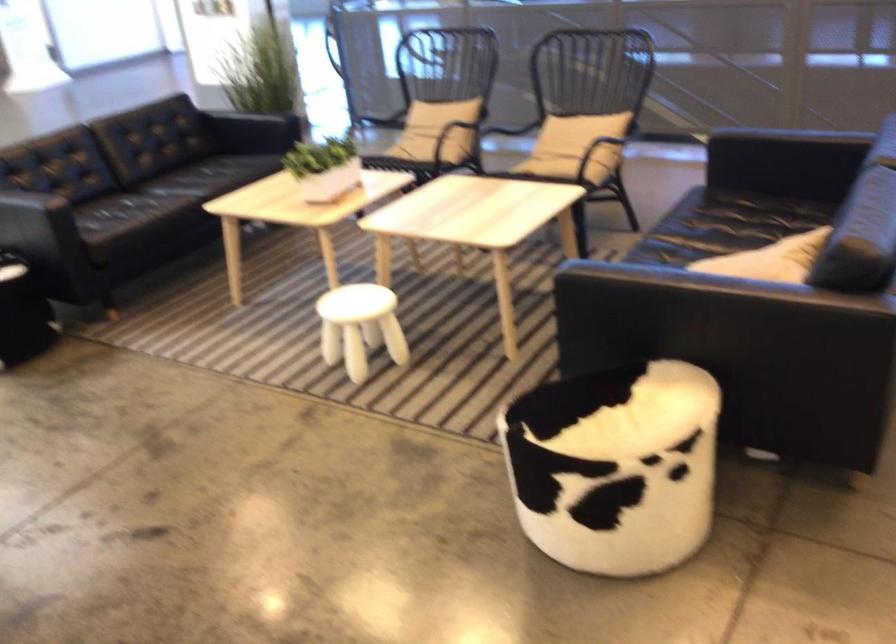
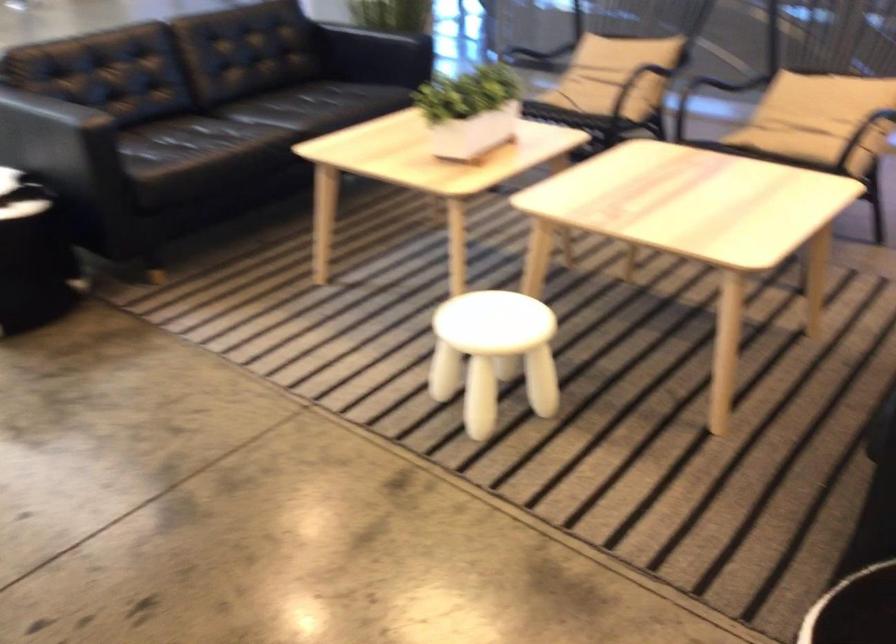
In the second image, find the point that corresponds to the point at 595,149 in the first image.

(866, 128)